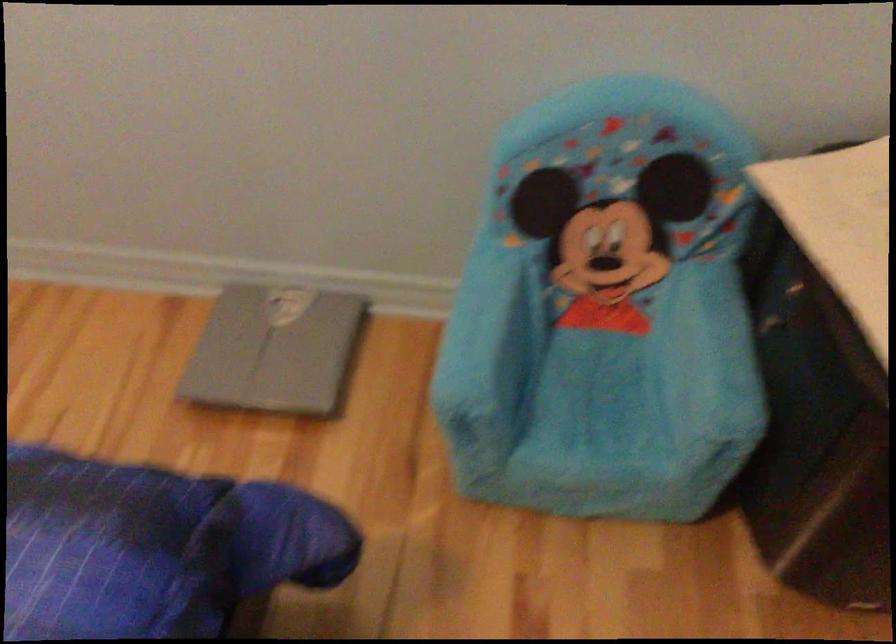
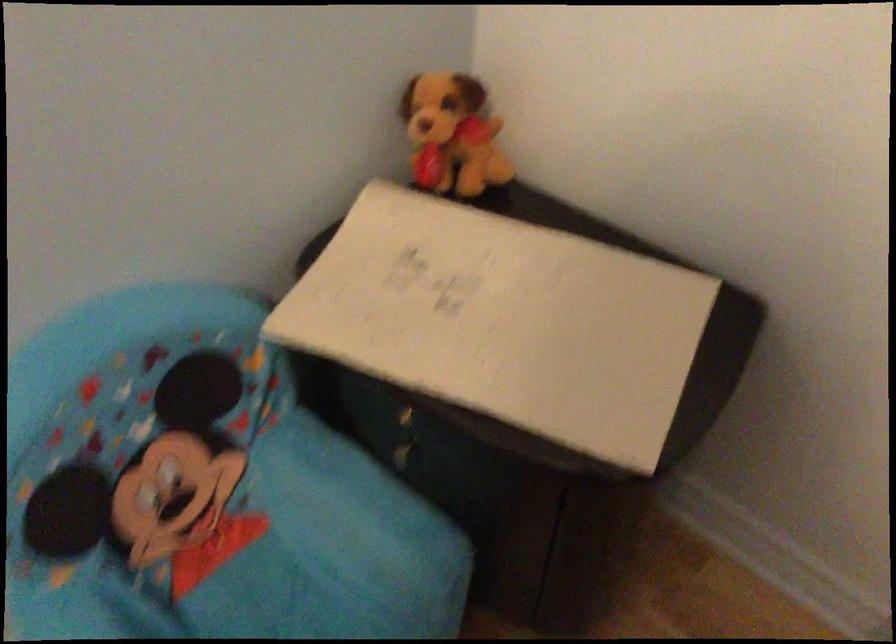
In the second image, find the point that corresponds to (596,322) in the first image.

(220, 554)